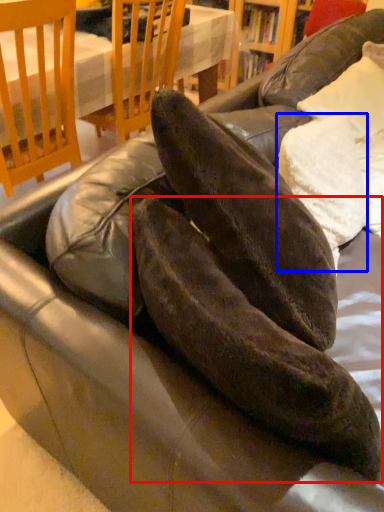
Question: Among these objects, which one is nearest to the camera, leather shoe (highlighted by a red box) or pillow (highlighted by a blue box)?

Choices:
 (A) leather shoe
 (B) pillow

Answer: (A)